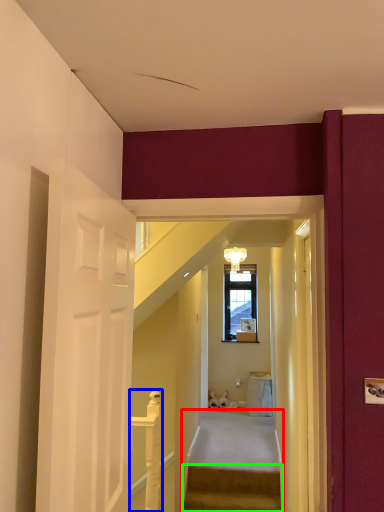
Question: Considering the real-world distances, which object is farthest from stairs (highlighted by a red box)? balustrade (highlighted by a blue box) or stairs (highlighted by a green box)?

Choices:
 (A) balustrade
 (B) stairs

Answer: (A)